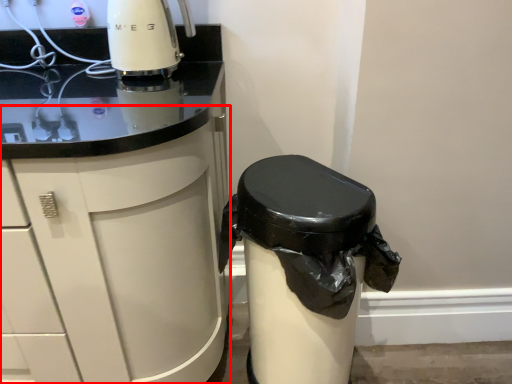
Question: Considering the relative positions of cabinetry (annotated by the red box) and waste container in the image provided, where is cabinetry (annotated by the red box) located with respect to the staircase?

Choices:
 (A) right
 (B) left

Answer: (B)